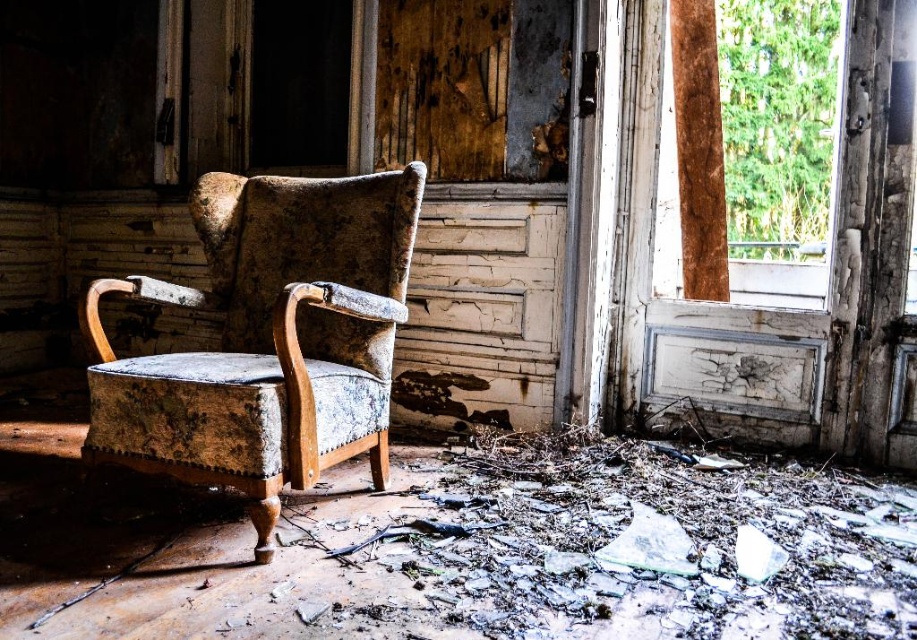
Who is shorter, distressed velvet armchair at center or wooden frame at right?

With less height is distressed velvet armchair at center.

Can you confirm if distressed velvet armchair at center is taller than wooden frame at right?

In fact, distressed velvet armchair at center may be shorter than wooden frame at right.

Is point (288, 451) farther from camera compared to point (802, 120)?

No.

Locate an element on the screen. This screenshot has width=917, height=640. distressed velvet armchair at center is located at coordinates (267, 339).